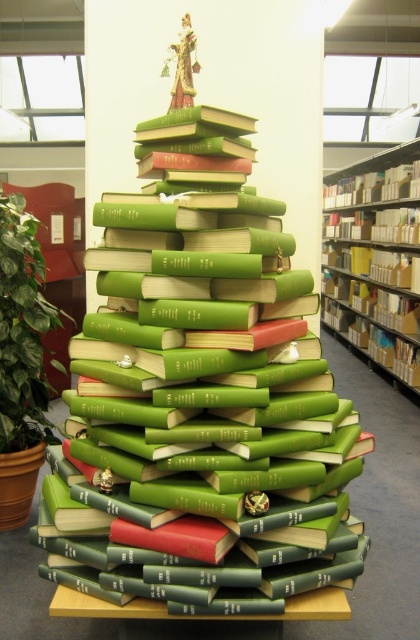
Is green matte books at center closer to camera compared to green leafy plant at left?

Yes, it is.

Can you confirm if green matte books at center is taller than green leafy plant at left?

Yes.

Which is behind, point (280, 316) or point (28, 326)?

The point (28, 326) is behind.

In order to click on green matte books at center in this screenshot , I will do `click(201, 397)`.

Is yellow cardboard bookshelf at right smaller than green leafy plant at left?

Actually, yellow cardboard bookshelf at right might be larger than green leafy plant at left.

Between point (398, 236) and point (36, 387), which one is positioned behind?

The point (398, 236) is more distant.

Identify the location of yellow cardboard bookshelf at right. (375, 260).

Which of these two, green matte books at center or yellow cardboard bookshelf at right, stands shorter?

green matte books at center

This screenshot has width=420, height=640. Find the location of `green matte books at center`. green matte books at center is located at coordinates (201, 397).

Who is more forward, (131, 358) or (393, 380)?

Point (131, 358)

Identify the location of green matte books at center. The image size is (420, 640). (201, 397).